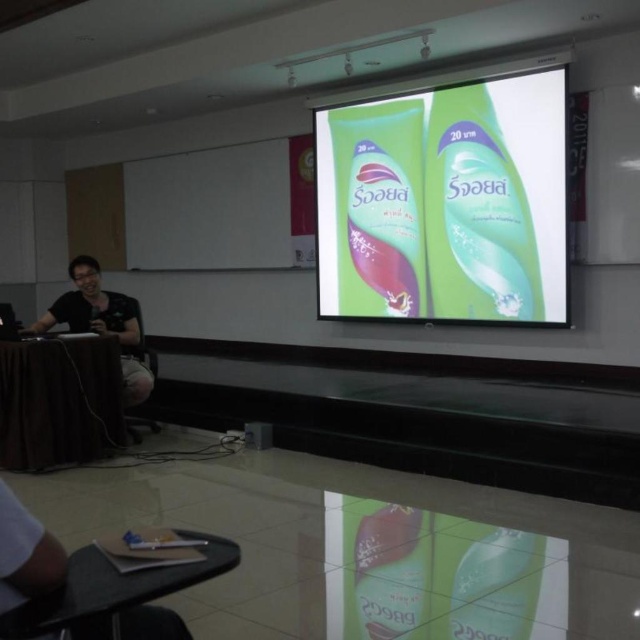
Measure the distance between green plastic tubes at center and black fabric table at left.

They are 10.50 feet apart.

Where is `green plastic tubes at center`? This screenshot has height=640, width=640. green plastic tubes at center is located at coordinates (445, 204).

In the scene shown: Who is more distant from viewer, (x=452, y=204) or (x=99, y=419)?

The point (x=452, y=204) is behind.

The width and height of the screenshot is (640, 640). Find the location of `green plastic tubes at center`. green plastic tubes at center is located at coordinates [445, 204].

Which of these two, black fabric table at left or black matte shirt at left, stands shorter?

Standing shorter between the two is black fabric table at left.

Is black fabric table at left further to the viewer compared to black matte shirt at left?

No, black fabric table at left is closer to the viewer.

Locate an element on the screen. black fabric table at left is located at coordinates (60, 401).

At what (x,y) coordinates should I click in order to perform the action: click on black fabric table at left. Please return your answer as a coordinate pair (x, y). Looking at the image, I should click on (60, 401).

Who is positioned more to the left, green plastic tubes at center or black matte shirt at left?

black matte shirt at left

Consider the image. Does green plastic tubes at center appear on the left side of black matte shirt at left?

No, green plastic tubes at center is not to the left of black matte shirt at left.

Locate an element on the screen. The width and height of the screenshot is (640, 640). green plastic tubes at center is located at coordinates (445, 204).

Identify the location of green plastic tubes at center. (445, 204).